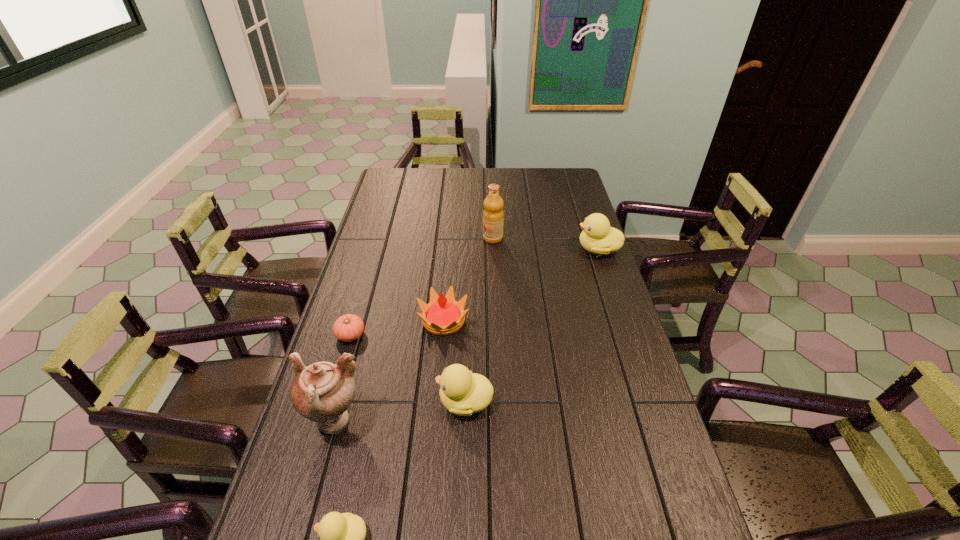
At what (x,y) coordinates should I click in order to perform the action: click on vacant area located at the beak of the second tallest duckling. Please return your answer as a coordinate pair (x, y). This screenshot has height=540, width=960. Looking at the image, I should click on (351, 401).

You are a GUI agent. You are given a task and a screenshot of the screen. Output one action in this format:
    pyautogui.click(x=<x>, y=<y>)
    Task: Click on the free space located 0.240m at the beak of the rightmost object
    This screenshot has width=960, height=540.
    Given the screenshot: What is the action you would take?
    pyautogui.click(x=513, y=249)

Image resolution: width=960 pixels, height=540 pixels. I want to click on vacant point located at the beak of the rightmost object, so click(x=476, y=249).

Identify the location of vacant space located 0.090m at the beak of the rightmost object. (552, 249).

Where is `vacant space located on the front label of the fruit juice`? This screenshot has height=540, width=960. vacant space located on the front label of the fruit juice is located at coordinates (415, 238).

Locate an element on the screen. The image size is (960, 540). vacant space located on the front label of the fruit juice is located at coordinates tap(412, 238).

The image size is (960, 540). I want to click on blank space located on the front label of the fruit juice, so click(430, 238).

The height and width of the screenshot is (540, 960). I want to click on free space located 0.060m on the front of the tomato, so click(343, 363).

Identify the location of vacant space located 0.370m on the front of the crown. This screenshot has width=960, height=540. (432, 457).

Identify the location of blank area located 0.140m on the back of the urn. (353, 356).